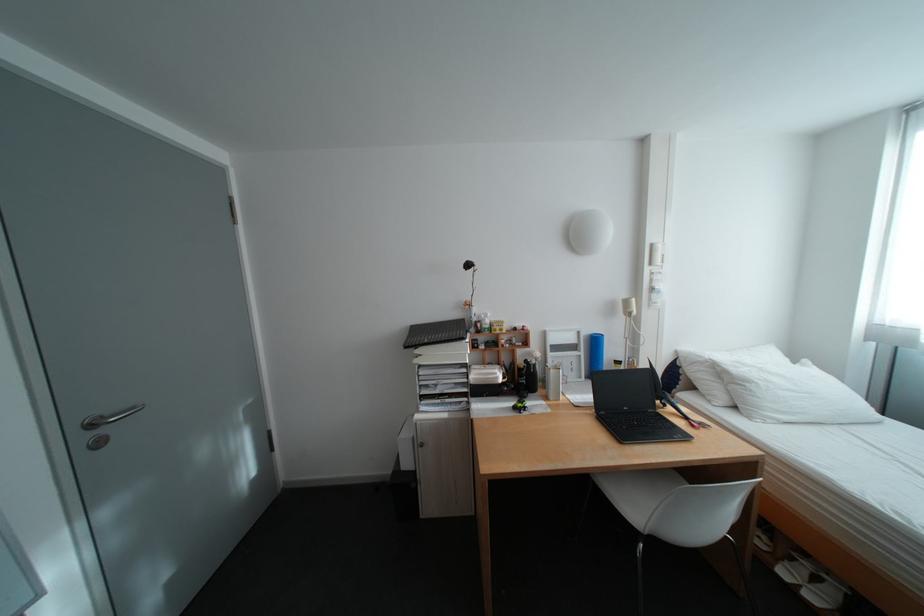
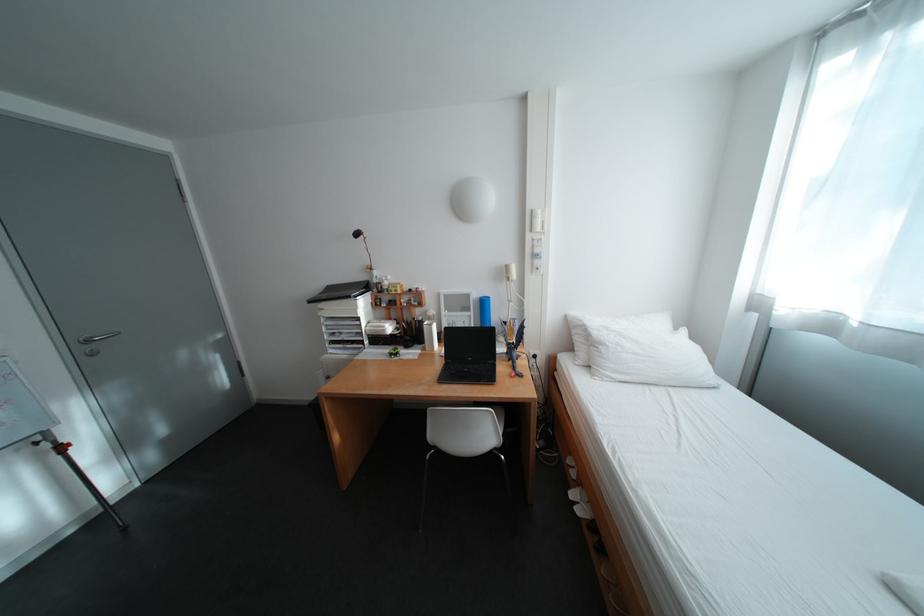
In the second image, find the point that corresponds to pixel 451 387 in the first image.

(355, 336)